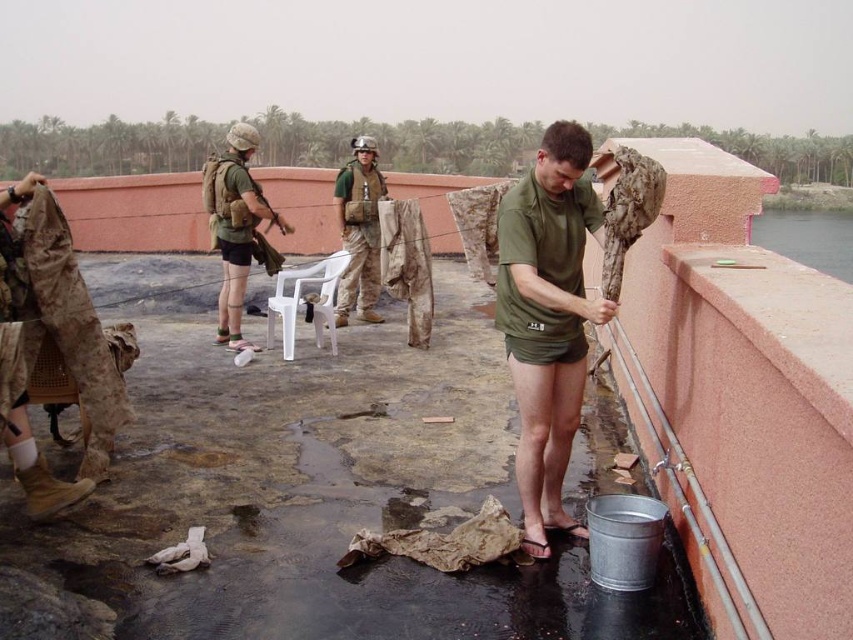
You are standing on the rooftop and see the green matte shirt at center and the clear water at edge right. Which object is closer to the edge of the rooftop?

The clear water at edge right is closer to the edge of the rooftop since it is positioned at the edge, while the green matte shirt at center is located under it.

You are organizing a camping gear storage area. You have two camouflage fabric vests to place on a shelf. The camouflage fabric vest at center and the camouflage fabric vest at upper center. Which one requires more horizontal space on the shelf?

The camouflage fabric vest at center requires more horizontal space on the shelf because its width surpasses that of the camouflage fabric vest at upper center.